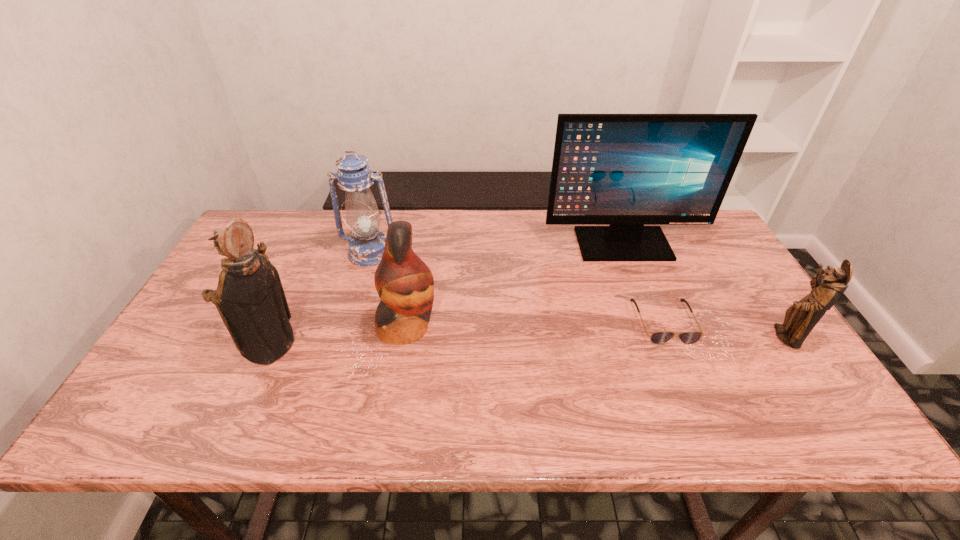
You are a GUI agent. You are given a task and a screenshot of the screen. Output one action in this format:
    pyautogui.click(x=<x>, y=<y>)
    Task: Click on the free space located on the front-facing side of the left figurine
    This screenshot has height=540, width=960.
    Given the screenshot: What is the action you would take?
    pyautogui.click(x=212, y=346)

I want to click on vacant space located 0.140m on the front-facing side of the shorter figurine, so click(x=709, y=337).

I want to click on free space located on the front-facing side of the shorter figurine, so click(x=698, y=337).

The width and height of the screenshot is (960, 540). I want to click on vacant space situated 0.300m on the front-facing side of the shorter figurine, so click(x=646, y=337).

This screenshot has width=960, height=540. I want to click on vacant area situated on the screen side of the monitor, so click(672, 371).

This screenshot has width=960, height=540. I want to click on vacant space located on the front-facing side of the lantern, so 350,319.

The height and width of the screenshot is (540, 960). I want to click on free point located 0.120m on the face of the parrot, so click(484, 327).

The image size is (960, 540). I want to click on monitor that is at the far edge, so click(623, 170).

This screenshot has height=540, width=960. Identify the location of lantern present at the far edge. (366, 247).

Identify the location of object situated at the near edge. (250, 298).